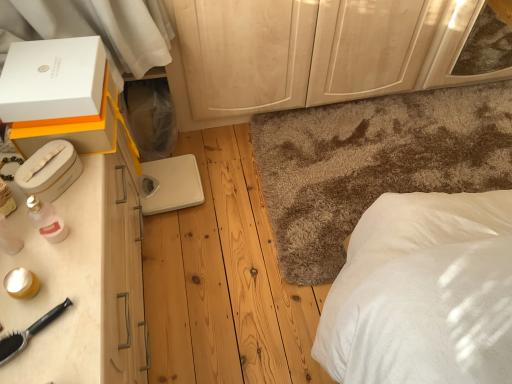
Locate an element on the screen. The image size is (512, 384). vacant space that's between white plastic scale at center and shaggy carpet at center is located at coordinates (226, 196).